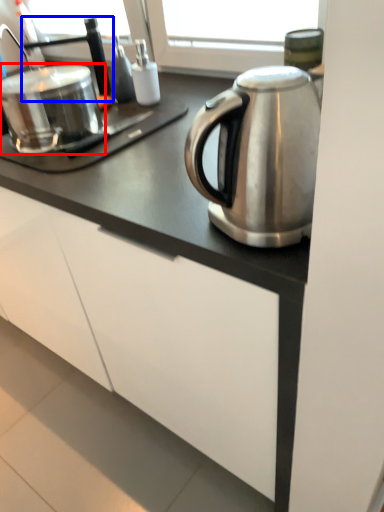
Question: Which object is further to the camera taking this photo, appliance (highlighted by a red box) or faucet (highlighted by a blue box)?

Choices:
 (A) appliance
 (B) faucet

Answer: (B)